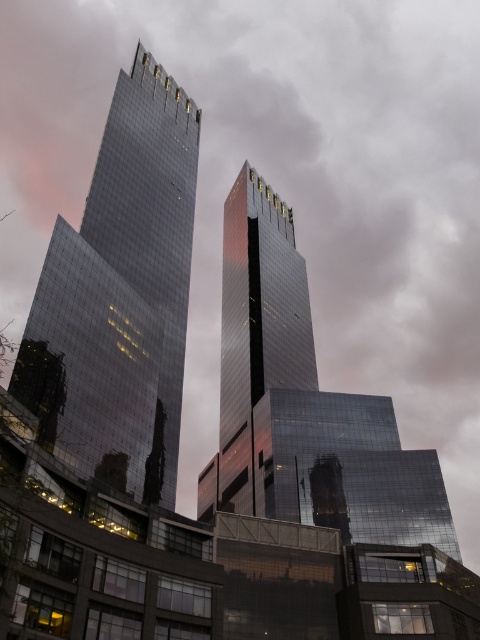
Does shiny glass tower at center have a greater width compared to shiny glass skyscraper at center?

Incorrect, shiny glass tower at center's width does not surpass shiny glass skyscraper at center's.

The width and height of the screenshot is (480, 640). What do you see at coordinates (120, 298) in the screenshot?
I see `shiny glass tower at center` at bounding box center [120, 298].

Locate an element on the screen. The height and width of the screenshot is (640, 480). shiny glass tower at center is located at coordinates (120, 298).